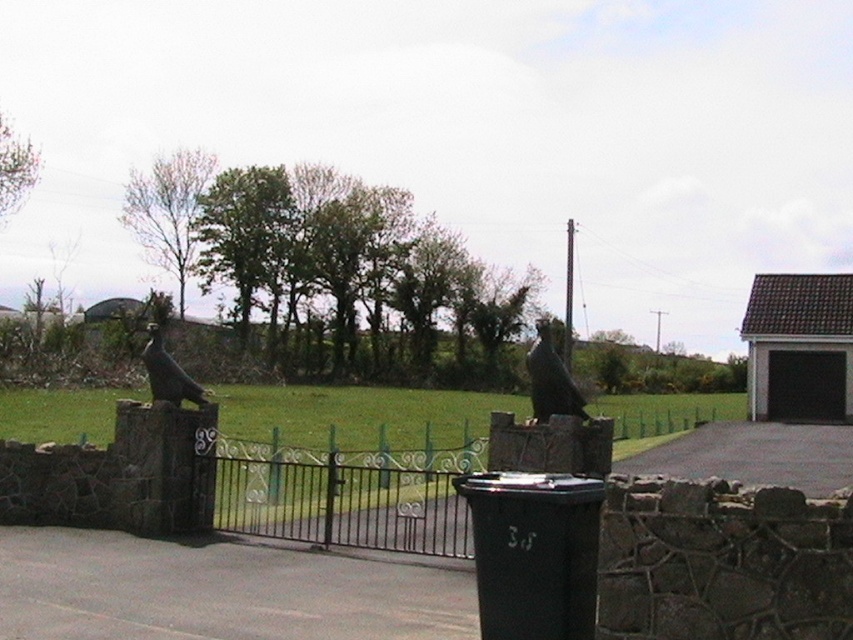
You are a delivery person trying to deliver a package to the property. The gate is partially open, but you need to know if your 2.5 meter wide delivery truck can pass through the opening. The black wrought iron gate at center and the matte black bird at left are part of the structure. Can the truck fit through the opening between them?

The distance between the black wrought iron gate at center and the matte black bird at left is 7.77 meters. Since the truck is only 2.5 meters wide, it can easily pass through the opening as the width is sufficient.

You are a delivery person trying to enter the property through the black wrought iron gate at center. There is a matte black bird at left on the wall. Can you fit through the gate without bending down?

The black wrought iron gate at center is taller than the matte black bird at left. Since the gate is taller than the bird statue, which is positioned on the wall, it is likely that the gate is sufficiently tall for a person to pass through without needing to bend down. Therefore, you can fit through the gate without bending down.